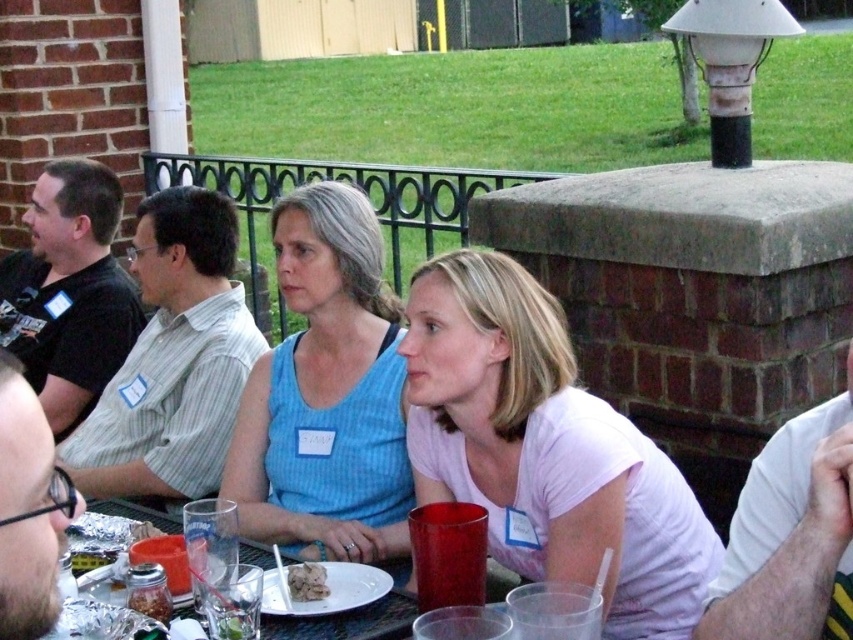
Question: Can you confirm if pink matte shirt at center is positioned above white crumbly food at center?

Choices:
 (A) no
 (B) yes

Answer: (B)

Question: Observing the image, what is the correct spatial positioning of blue striped tank top at center in reference to clear plastic plate at lower center?

Choices:
 (A) above
 (B) below

Answer: (A)

Question: Which object is the closest to the blue striped tank top at center?

Choices:
 (A) pink matte shirt at center
 (B) clear plastic plate at lower center

Answer: (A)

Question: Among these objects, which one is farthest from the camera?

Choices:
 (A) blue striped tank top at center
 (B) clear plastic plate at lower center
 (C) white crumbly food at center
 (D) pink matte shirt at center

Answer: (A)

Question: Among these objects, which one is nearest to the camera?

Choices:
 (A) clear plastic plate at lower center
 (B) white crumbly food at center
 (C) blue striped tank top at center

Answer: (B)

Question: Is clear plastic plate at lower center to the right of white crumbly food at center from the viewer's perspective?

Choices:
 (A) no
 (B) yes

Answer: (A)